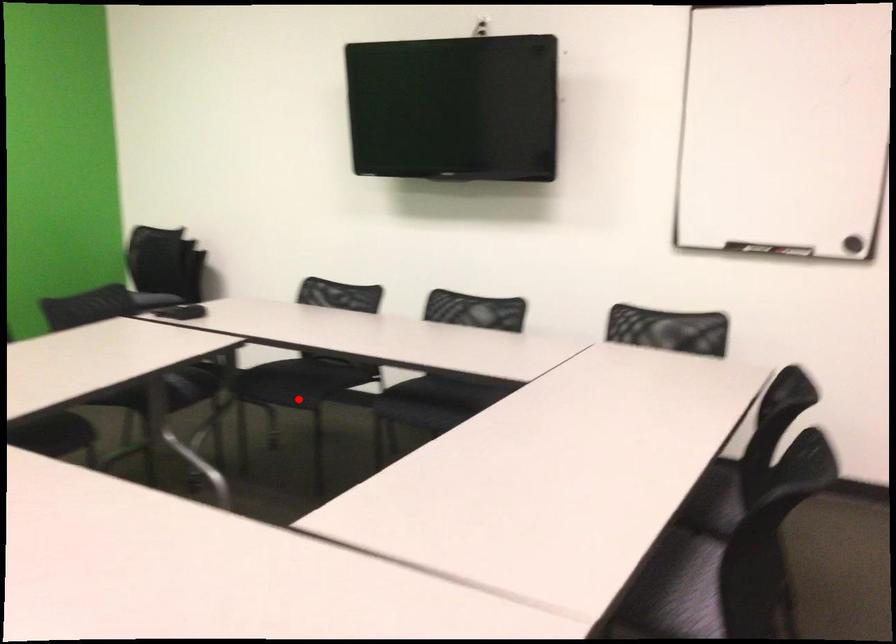
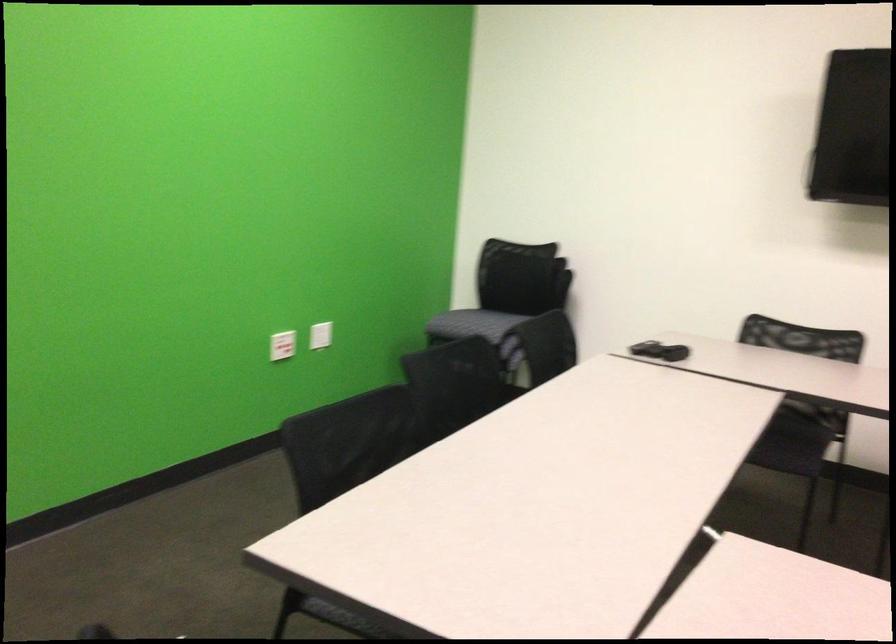
Question: A red point is marked in image1. In image2, is the corresponding 3D point closer to the camera or farther? Reply with the corresponding letter.

Choices:
 (A) The corresponding 3D point is closer.
 (B) The corresponding 3D point is farther.

Answer: (A)